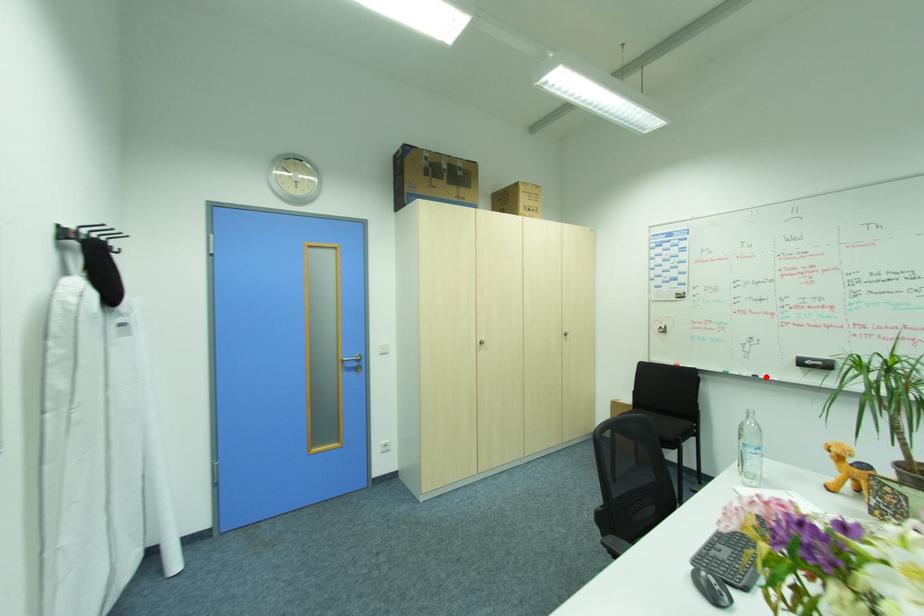
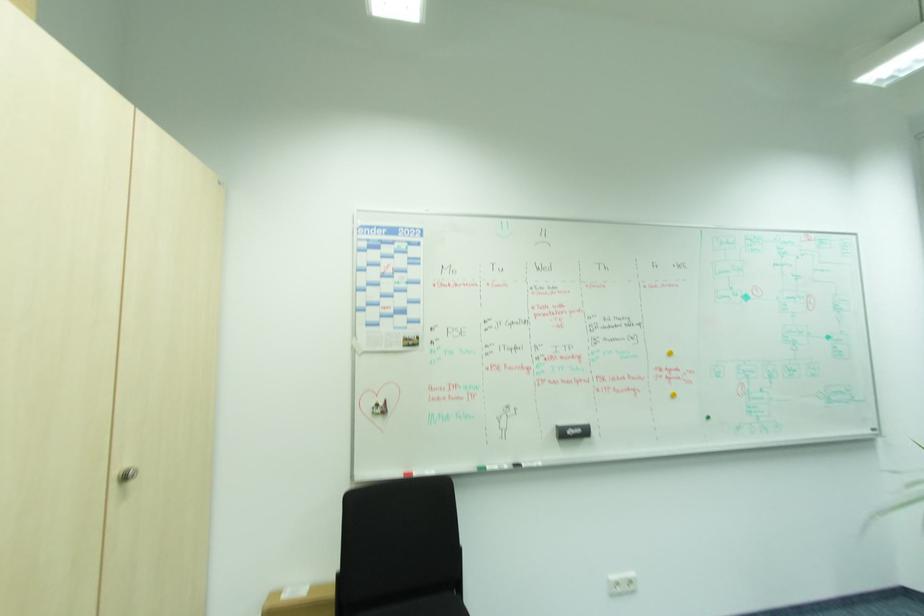
Find the pixel in the second image that matches the highlighted location in the first image.

(528, 464)